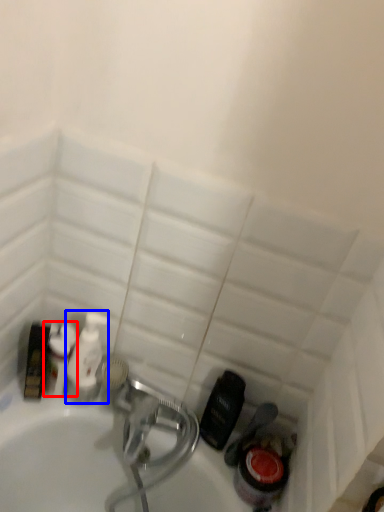
Question: Among these objects, which one is nearest to the camera, cleaning product (highlighted by a red box) or cleaning product (highlighted by a blue box)?

Choices:
 (A) cleaning product
 (B) cleaning product

Answer: (A)